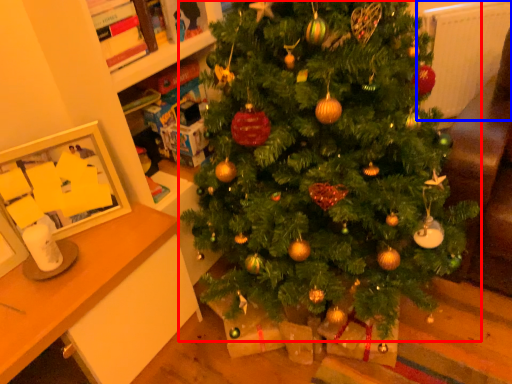
Question: Which object appears farthest to the camera in this image, christmas tree (highlighted by a red box) or radiator (highlighted by a blue box)?

Choices:
 (A) christmas tree
 (B) radiator

Answer: (B)